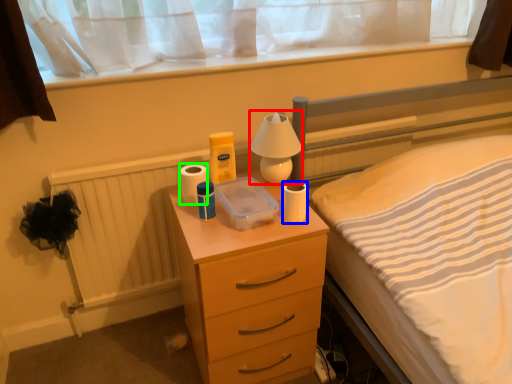
Question: Which is nearer to the bedside lamp (highlighted by a red box)? toilet paper (highlighted by a blue box) or toilet paper (highlighted by a green box).

Choices:
 (A) toilet paper
 (B) toilet paper

Answer: (A)